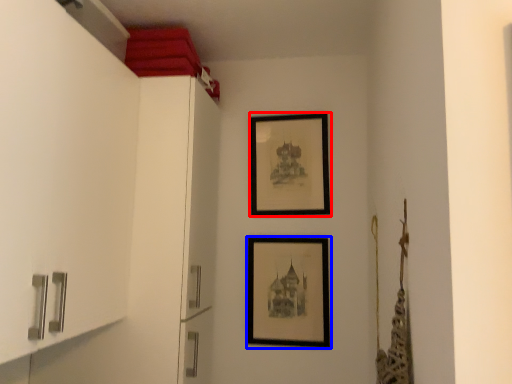
Question: Among these objects, which one is nearest to the camera, picture frame (highlighted by a red box) or picture frame (highlighted by a blue box)?

Choices:
 (A) picture frame
 (B) picture frame

Answer: (B)